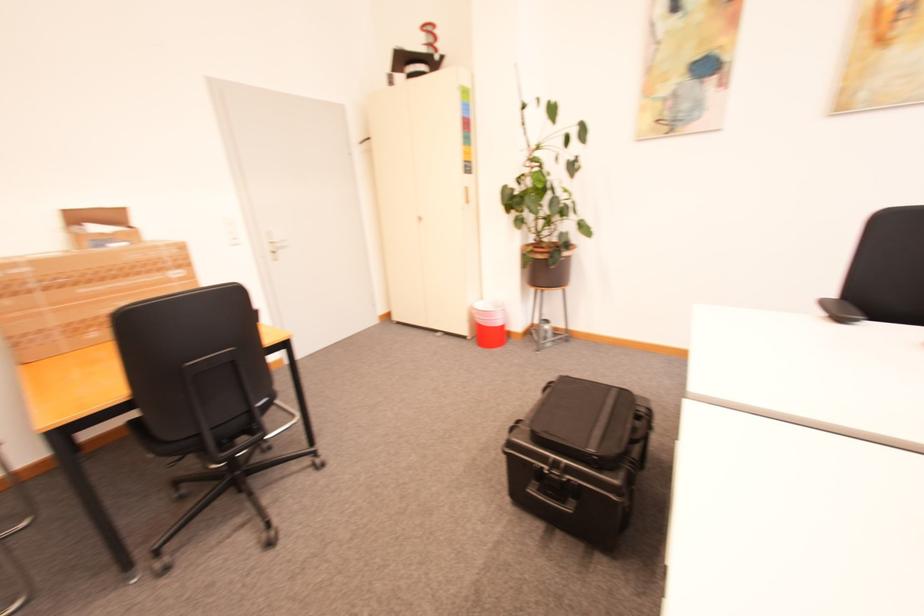
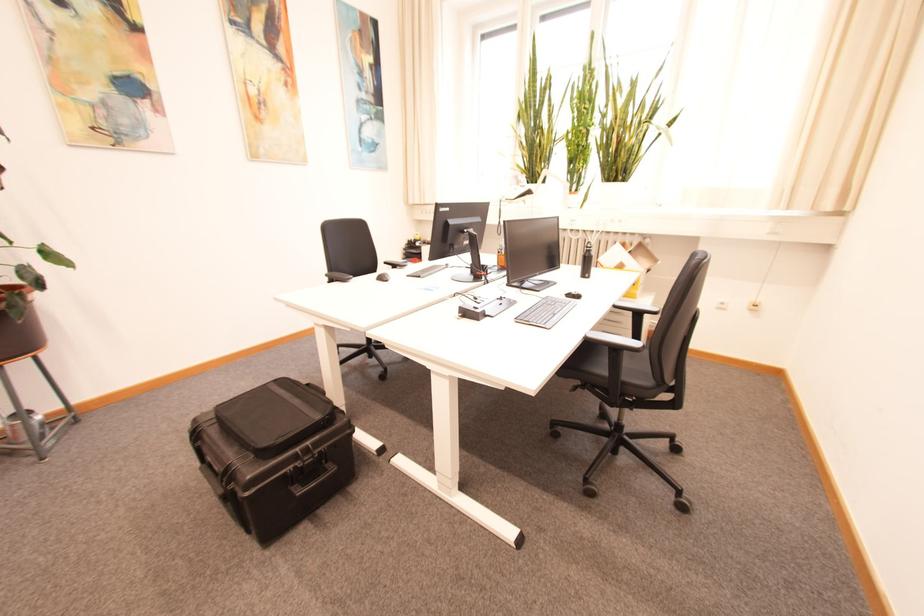
The point at (546, 492) is marked in the first image. Where is the corresponding point in the second image?

(310, 485)